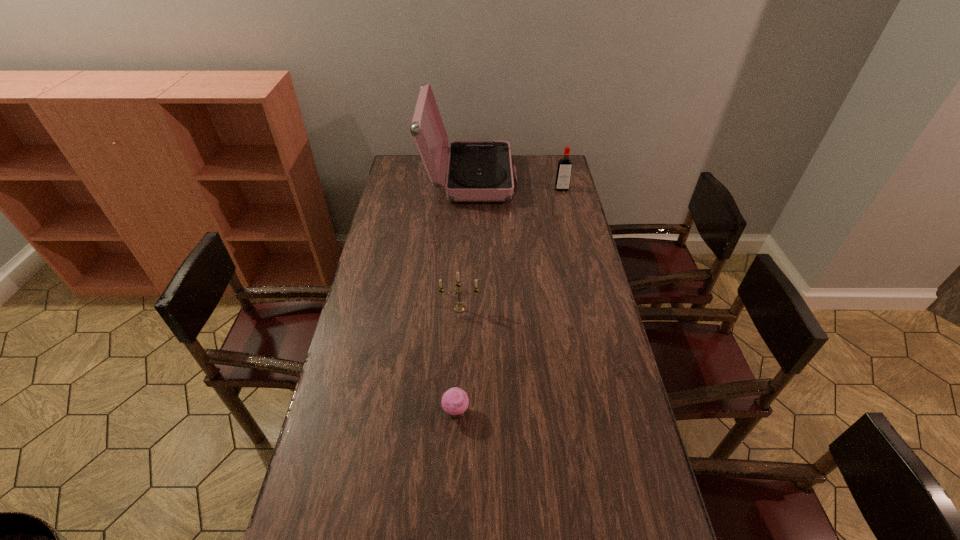
This screenshot has width=960, height=540. Find the location of `free space located 0.120m on the front of the second nearest object`. free space located 0.120m on the front of the second nearest object is located at coordinates (453, 468).

The width and height of the screenshot is (960, 540). What are the coordinates of `object that is at the far edge` in the screenshot? It's located at (478, 171).

Where is `object that is at the left edge`? The height and width of the screenshot is (540, 960). object that is at the left edge is located at coordinates (478, 171).

Image resolution: width=960 pixels, height=540 pixels. I want to click on object that is at the right edge, so click(564, 169).

I want to click on object present at the far left corner, so click(478, 171).

This screenshot has width=960, height=540. In the image, there is a desktop. What are the coordinates of `vacant space at the left edge` in the screenshot? It's located at (407, 209).

In the image, there is a desktop. Where is `vacant space at the right edge`? vacant space at the right edge is located at coordinates (570, 202).

This screenshot has width=960, height=540. In order to click on vacant space at the far right corner of the desktop in this screenshot , I will do `click(535, 159)`.

Locate an element on the screen. vacant area that lies between the rightmost object and the record player is located at coordinates (516, 184).

The height and width of the screenshot is (540, 960). What are the coordinates of `free space between the second nearest object and the tallest object` in the screenshot? It's located at (463, 295).